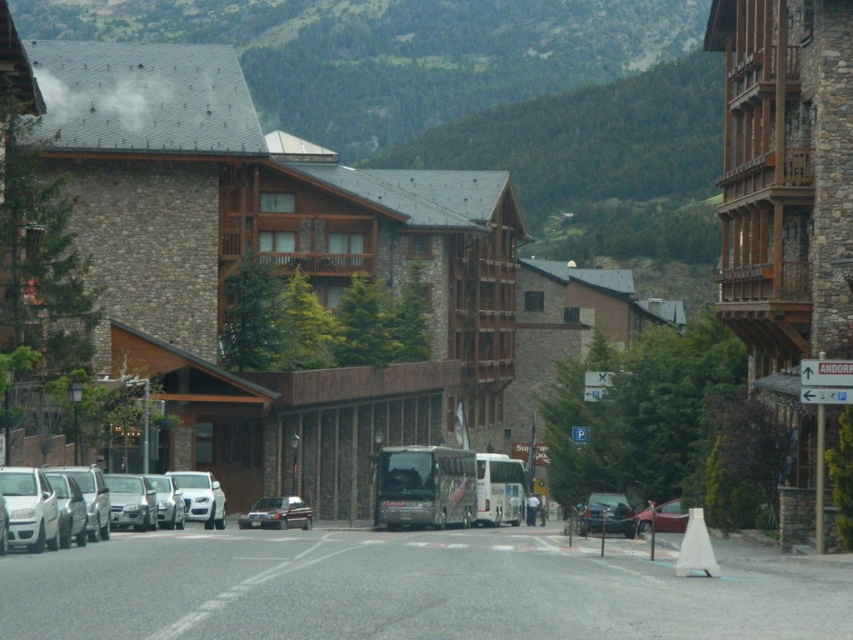
Which is below, metallic blue sedan at center or metallic silver sedan at center?

metallic blue sedan at center is below.

Can you confirm if metallic blue sedan at center is taller than metallic silver sedan at center?

No, metallic blue sedan at center is not taller than metallic silver sedan at center.

Locate an element on the screen. The image size is (853, 640). metallic blue sedan at center is located at coordinates (607, 515).

Is green grassy mountain at upper center positioned at the back of metallic blue sedan at center?

Yes, green grassy mountain at upper center is further from the viewer.

Does green grassy mountain at upper center have a greater height compared to metallic blue sedan at center?

Indeed, green grassy mountain at upper center has a greater height compared to metallic blue sedan at center.

Measure the distance between point (279, 109) and camera.

Point (279, 109) and camera are 273.53 meters apart from each other.

Locate an element on the screen. green grassy mountain at upper center is located at coordinates (532, 132).

Between green grassy mountain at upper center and white matte car at left, which one appears on the left side from the viewer's perspective?

Positioned to the left is white matte car at left.

Is point (529, 172) closer to camera compared to point (35, 522)?

No, it is not.

In the scene shown: Who is more forward, (711, 234) or (90, 490)?

Positioned in front is point (90, 490).

Find the location of a particular element. The height and width of the screenshot is (640, 853). green grassy mountain at upper center is located at coordinates (532, 132).